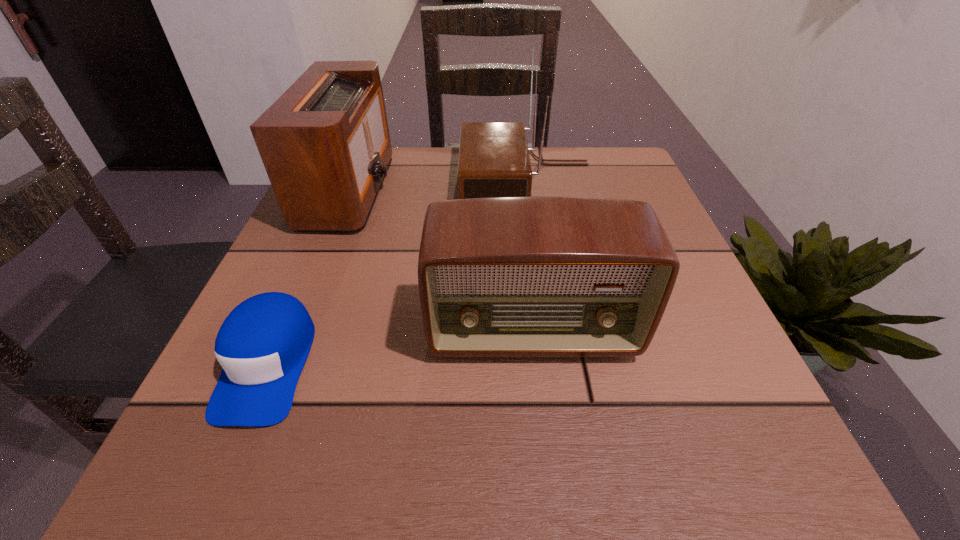
Identify the location of object that is positioned at the near left corner. (x=262, y=345).

Find the location of a particular element. object that is positioned at the far right corner is located at coordinates 494,161.

Where is `vacant area at the far edge of the desktop`? This screenshot has width=960, height=540. vacant area at the far edge of the desktop is located at coordinates (444, 151).

This screenshot has height=540, width=960. In the image, there is a desktop. What are the coordinates of `free region at the near edge` in the screenshot? It's located at (604, 436).

This screenshot has width=960, height=540. In order to click on free space at the left edge of the desktop in this screenshot , I will do `click(340, 267)`.

The width and height of the screenshot is (960, 540). Find the location of `vacant space at the right edge`. vacant space at the right edge is located at coordinates (668, 230).

The image size is (960, 540). In order to click on empty location between the leftmost radio receiver and the shortest object in this screenshot , I will do `click(309, 277)`.

Where is `vacant area that lies between the shortest object and the nearest radio receiver`? The height and width of the screenshot is (540, 960). vacant area that lies between the shortest object and the nearest radio receiver is located at coordinates (400, 348).

In order to click on blank region between the nearest radio receiver and the baseball cap in this screenshot , I will do `click(400, 348)`.

Identify the location of free point between the nearest radio receiver and the shortest object. (400, 348).